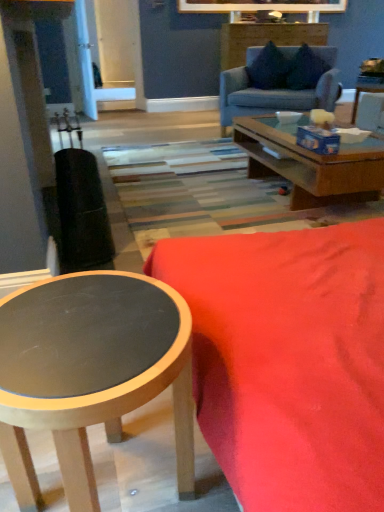
Question: From the image's perspective, is matte black coffee table at lower left under wooden side table at upper right?

Choices:
 (A) yes
 (B) no

Answer: (A)

Question: Is matte black coffee table at lower left closer to camera compared to wooden side table at upper right?

Choices:
 (A) no
 (B) yes

Answer: (B)

Question: Would you say matte black coffee table at lower left is outside wooden side table at upper right?

Choices:
 (A) yes
 (B) no

Answer: (A)

Question: Could you tell me if matte black coffee table at lower left is facing wooden side table at upper right?

Choices:
 (A) no
 (B) yes

Answer: (A)

Question: Considering the relative sizes of matte black coffee table at lower left and wooden side table at upper right in the image provided, is matte black coffee table at lower left taller than wooden side table at upper right?

Choices:
 (A) yes
 (B) no

Answer: (A)

Question: Does matte black coffee table at lower left have a lesser height compared to wooden side table at upper right?

Choices:
 (A) no
 (B) yes

Answer: (A)

Question: Is velvet red couch at lower right, the second studio couch in the back-to-front sequence, next to wooden side table at upper right and touching it?

Choices:
 (A) yes
 (B) no

Answer: (B)

Question: Could wooden side table at upper right be considered to be inside velvet red couch at lower right, which ranks as the second studio couch in top-to-bottom order?

Choices:
 (A) yes
 (B) no

Answer: (B)

Question: Is velvet red couch at lower right, marked as the 1th studio couch in a bottom-to-top arrangement, not near wooden side table at upper right?

Choices:
 (A) yes
 (B) no

Answer: (A)

Question: Is velvet red couch at lower right, which ranks as the second studio couch in top-to-bottom order, closer to camera compared to wooden side table at upper right?

Choices:
 (A) no
 (B) yes

Answer: (B)

Question: Considering the relative sizes of velvet red couch at lower right, the second studio couch in the back-to-front sequence, and wooden side table at upper right in the image provided, is velvet red couch at lower right, the second studio couch in the back-to-front sequence, taller than wooden side table at upper right?

Choices:
 (A) no
 (B) yes

Answer: (A)

Question: Can you confirm if velvet red couch at lower right, marked as the 1th studio couch in a bottom-to-top arrangement, is positioned to the left of wooden side table at upper right?

Choices:
 (A) yes
 (B) no

Answer: (A)

Question: From the image's perspective, is wooden side table at upper right located above light blue fabric couch at upper center, marked as the second studio couch in a bottom-to-top arrangement?

Choices:
 (A) yes
 (B) no

Answer: (B)